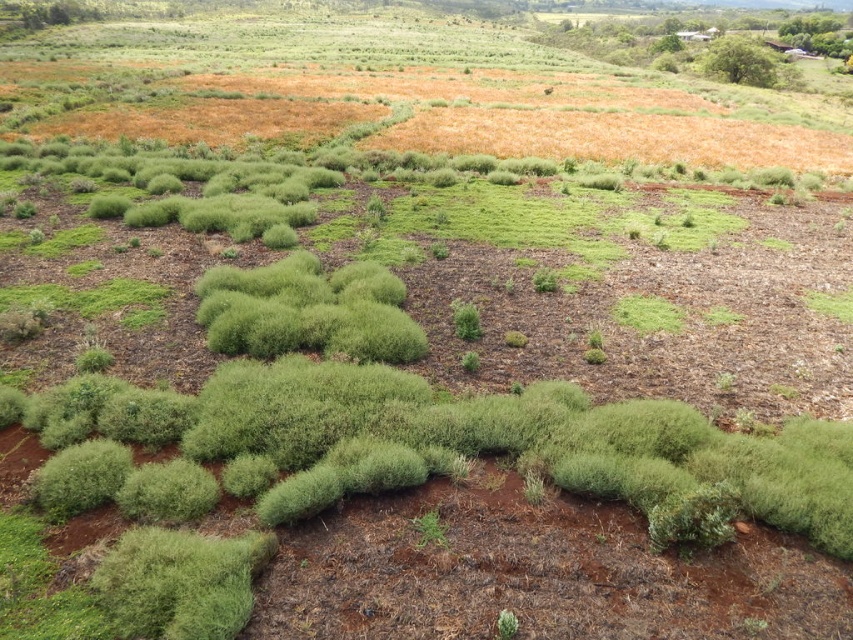
Question: Observing the image, what is the correct spatial positioning of green leafy bush at upper right in reference to green fuzzy bush at center?

Choices:
 (A) above
 (B) below

Answer: (A)

Question: Which point is closer to the camera taking this photo?

Choices:
 (A) (751, 51)
 (B) (445, 528)

Answer: (B)

Question: Which point is farther from the camera taking this photo?

Choices:
 (A) (425, 536)
 (B) (741, 81)

Answer: (B)

Question: Among these points, which one is farthest from the camera?

Choices:
 (A) (421, 525)
 (B) (721, 44)

Answer: (B)

Question: Does green leafy bush at upper right come behind green fuzzy bush at center?

Choices:
 (A) yes
 (B) no

Answer: (A)

Question: Can you confirm if green leafy bush at upper right is positioned to the right of green fuzzy bush at center?

Choices:
 (A) no
 (B) yes

Answer: (B)